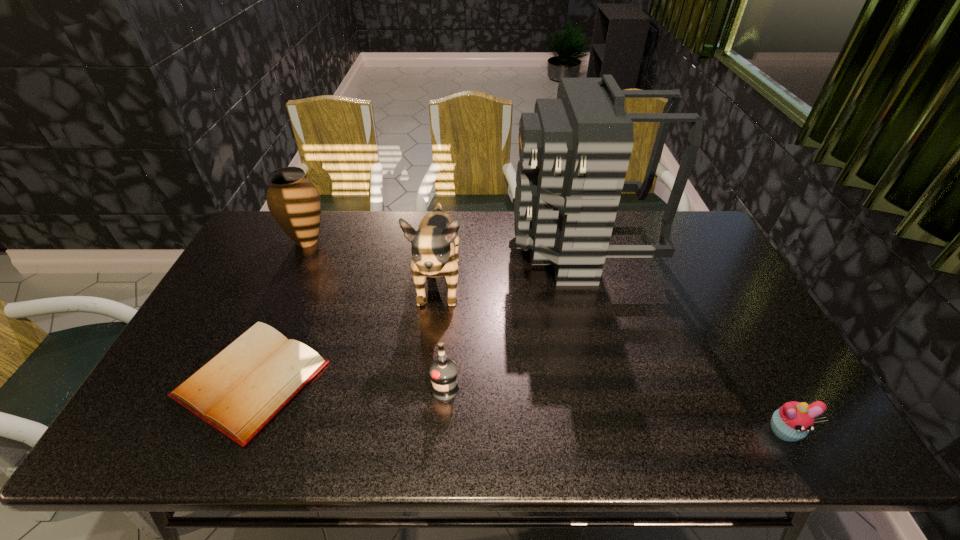
Identify the location of free area in between the fifth shortest object and the backpack. The image size is (960, 540). (509, 265).

Where is `unoccupied position between the second object from right to left and the second tallest object`? This screenshot has width=960, height=540. unoccupied position between the second object from right to left and the second tallest object is located at coordinates (509, 265).

At what (x,y) coordinates should I click in order to perform the action: click on vacant area between the third shortest object and the second tallest object. Please return your answer as a coordinate pair (x, y). This screenshot has width=960, height=540. Looking at the image, I should click on (442, 335).

Locate an element on the screen. The image size is (960, 540). vacant point located between the third tallest object and the rightmost object is located at coordinates (545, 336).

Image resolution: width=960 pixels, height=540 pixels. Identify the location of free space that is in between the second tallest object and the urn. (372, 262).

Where is `unoccupied position between the fourth tallest object and the puppy`? unoccupied position between the fourth tallest object and the puppy is located at coordinates (442, 335).

Identify the location of free spot between the rightmost object and the fourth shortest object. The image size is (960, 540). (545, 336).

Where is `empty space that is in between the second object from right to left and the shortest object`? The height and width of the screenshot is (540, 960). empty space that is in between the second object from right to left and the shortest object is located at coordinates (416, 313).

At what (x,y) coordinates should I click in order to perform the action: click on vacant point located between the second shortest object and the urn. Please return your answer as a coordinate pair (x, y). The image size is (960, 540). Looking at the image, I should click on (545, 336).

Find the location of a particular element. object that stands as the fourth closest to the fifth object from left to right is located at coordinates (239, 391).